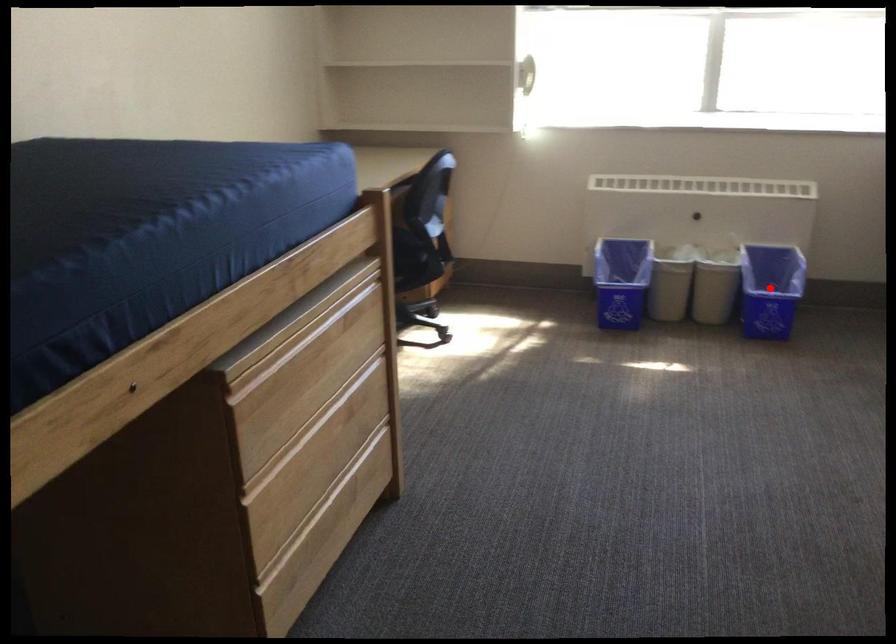
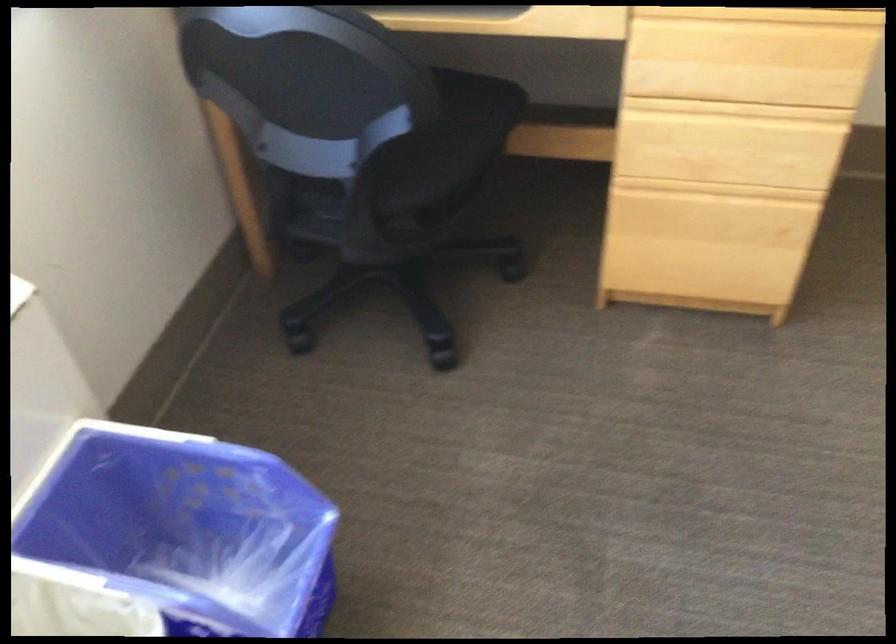
Where in the second image is the point corresponding to the highlighted location from the first image?

(183, 531)